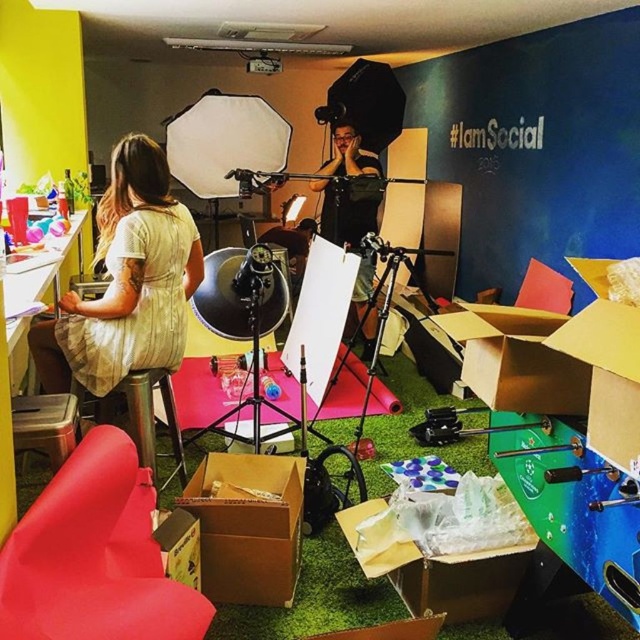
Between cardboard box at center and brown cardboard box at center, which one has more height?

brown cardboard box at center is taller.

Is cardboard box at center to the right of brown cardboard box at center from the viewer's perspective?

Correct, you'll find cardboard box at center to the right of brown cardboard box at center.

Identify the location of cardboard box at center. This screenshot has width=640, height=640. (445, 554).

Find the location of a particular element. The height and width of the screenshot is (640, 640). cardboard box at center is located at coordinates (445, 554).

Between point (266, 477) and point (371, 182), which one is positioned in front?

Point (266, 477)

Does brown cardboard box at center have a smaller size compared to black matte shirt at center?

Correct, brown cardboard box at center occupies less space than black matte shirt at center.

The height and width of the screenshot is (640, 640). Find the location of `brown cardboard box at center`. brown cardboard box at center is located at coordinates 248,525.

Does point (136, 288) come closer to viewer compared to point (513, 509)?

No, (136, 288) is further to viewer.

Is matte yellow dress at left taller than cardboard box at center?

Yes.

Where is `matte yellow dress at left`? matte yellow dress at left is located at coordinates (129, 280).